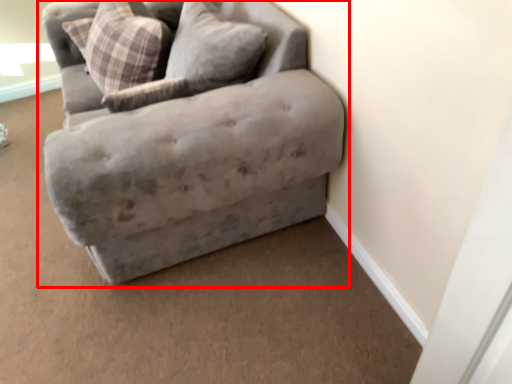
Question: In this image, where is studio couch (annotated by the red box) located relative to pillow?

Choices:
 (A) left
 (B) right

Answer: (B)